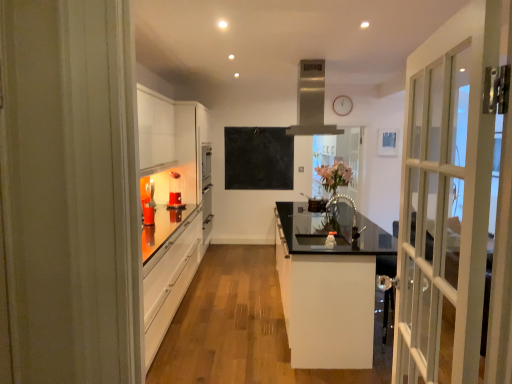
What is the approximate height of black matte chalkboard at center?

The height of black matte chalkboard at center is 1.00 meters.

In order to click on black matte chalkboard at center in this screenshot , I will do `click(258, 158)`.

What do you see at coordinates (334, 175) in the screenshot?
I see `pink floral bouquet at center` at bounding box center [334, 175].

Find the location of a particular element. The height and width of the screenshot is (384, 512). white glossy cabinet at center is located at coordinates (328, 285).

Locate an element on the screen. Image resolution: width=512 pixels, height=384 pixels. clear glass vase at center is located at coordinates (340, 155).

Locate an element on the screen. Image resolution: width=512 pixels, height=384 pixels. white wooden clock at upper center is located at coordinates (342, 105).

Considering the positions of objects clear glass vase at center and white wooden clock at upper center in the image provided, who is more to the left, clear glass vase at center or white wooden clock at upper center?

Positioned to the left is white wooden clock at upper center.

Does clear glass vase at center have a lesser height compared to white wooden clock at upper center?

No, clear glass vase at center is not shorter than white wooden clock at upper center.

From the image's perspective, between clear glass vase at center and white wooden clock at upper center, who is located below?

clear glass vase at center is shown below in the image.

How distant is clear glass vase at center from white wooden clock at upper center?

The distance of clear glass vase at center from white wooden clock at upper center is 38.72 inches.

Is pink floral bouquet at center oriented away from white wooden clock at upper center?

That's not correct — pink floral bouquet at center is not looking away from white wooden clock at upper center.

Considering the relative positions of pink floral bouquet at center and white wooden clock at upper center in the image provided, is pink floral bouquet at center to the left of white wooden clock at upper center from the viewer's perspective?

Correct, you'll find pink floral bouquet at center to the left of white wooden clock at upper center.

What are the coordinates of `flower located underneath the white wooden clock at upper center (from a real-world perspective)` in the screenshot? It's located at (334, 175).

Who is bigger, pink floral bouquet at center or white wooden clock at upper center?

pink floral bouquet at center.

Does white wooden clock at upper center turn towards matte orange glass at left?

No.

Identify the location of clock on the right of matte orange glass at left. (342, 105).

Does white wooden clock at upper center appear on the left side of matte orange glass at left?

Incorrect, white wooden clock at upper center is not on the left side of matte orange glass at left.

Is white wooden clock at upper center not within matte orange glass at left?

That's correct, white wooden clock at upper center is outside of matte orange glass at left.

Is matte orange glass at left facing towards clear glass vase at center?

No, matte orange glass at left is not oriented towards clear glass vase at center.

Can we say matte orange glass at left lies outside clear glass vase at center?

That's correct, matte orange glass at left is outside of clear glass vase at center.

In the scene shown: How different are the orientations of matte orange glass at left and clear glass vase at center in degrees?

63.7 degrees.

From a real-world perspective, which is physically above, matte orange glass at left or clear glass vase at center?

clear glass vase at center.

Relative to white glossy cabinet at center, is clear glass vase at center in front or behind?

clear glass vase at center is positioned farther from the viewer than white glossy cabinet at center.

Is clear glass vase at center wider or thinner than white glossy cabinet at center?

Clearly, clear glass vase at center has less width compared to white glossy cabinet at center.

Is clear glass vase at center positioned far away from white glossy cabinet at center?

Absolutely, clear glass vase at center is distant from white glossy cabinet at center.

Is the position of white glossy cabinet at center less distant than that of black matte chalkboard at center?

That is True.

Consider the image. Considering the positions of objects white glossy cabinet at center and black matte chalkboard at center in the image provided, who is more to the left, white glossy cabinet at center or black matte chalkboard at center?

black matte chalkboard at center.

Does white glossy cabinet at center have a larger size compared to black matte chalkboard at center?

Yes, white glossy cabinet at center is bigger than black matte chalkboard at center.

Is white glossy cabinet at center taller or shorter than black matte chalkboard at center?

Clearly, white glossy cabinet at center is shorter compared to black matte chalkboard at center.

Is point (323, 324) more distant than point (298, 109)?

No, (323, 324) is in front of (298, 109).

From the image's perspective, which is below, white glossy cabinet at center or satin silver exhaust hood at upper center?

white glossy cabinet at center is shown below in the image.

From a real-world perspective, is white glossy cabinet at center below satin silver exhaust hood at upper center?

Yes, from a real-world perspective, white glossy cabinet at center is under satin silver exhaust hood at upper center.

Is white glossy cabinet at center looking in the opposite direction of satin silver exhaust hood at upper center?

No, white glossy cabinet at center is not facing away from satin silver exhaust hood at upper center.

Where is `window directly beneath the white wooden clock at upper center (from a real-world perspective)`? Image resolution: width=512 pixels, height=384 pixels. window directly beneath the white wooden clock at upper center (from a real-world perspective) is located at coordinates (340, 155).

Where is `clock above the pink floral bouquet at center (from a real-world perspective)`? The width and height of the screenshot is (512, 384). clock above the pink floral bouquet at center (from a real-world perspective) is located at coordinates (342, 105).

Estimate the real-world distances between objects in this image. Which object is further from white wooden clock at upper center, matte orange glass at left or satin silver exhaust hood at upper center?

Among the two, matte orange glass at left is located further to white wooden clock at upper center.

Looking at the image, which one is located further to black matte chalkboard at center, clear glass vase at center or satin silver exhaust hood at upper center?

Based on the image, satin silver exhaust hood at upper center appears to be further to black matte chalkboard at center.

From the image, which object appears to be farther from white wooden clock at upper center, clear glass vase at center or pink floral bouquet at center?

clear glass vase at center is positioned further to the anchor white wooden clock at upper center.

Which object lies nearer to the anchor point white wooden clock at upper center, matte orange glass at left or white glossy cabinet at center?

matte orange glass at left.

Which object lies nearer to the anchor point satin silver exhaust hood at upper center, clear glass vase at center or white glossy cabinet at center?

Based on the image, white glossy cabinet at center appears to be nearer to satin silver exhaust hood at upper center.

From the image, which object appears to be farther from white wooden clock at upper center, white glossy cabinet at center or pink floral bouquet at center?

The object further to white wooden clock at upper center is white glossy cabinet at center.

When comparing their distances from black matte chalkboard at center, does pink floral bouquet at center or clear glass vase at center seem further?

pink floral bouquet at center lies further to black matte chalkboard at center than the other object.

Estimate the real-world distances between objects in this image. Which object is further from white glossy cabinet at center, white wooden clock at upper center or clear glass vase at center?

The object further to white glossy cabinet at center is white wooden clock at upper center.

Identify the location of clock positioned between white glossy cabinet at center and clear glass vase at center from near to far. (342, 105).

Identify the location of window between white glossy cabinet at center and black matte chalkboard at center along the z-axis. This screenshot has height=384, width=512. (340, 155).

I want to click on appliance between satin silver exhaust hood at upper center and clear glass vase at center along the z-axis, so click(x=175, y=191).

The height and width of the screenshot is (384, 512). Find the location of `exhaust hood between white glossy cabinet at center and clear glass vase at center in the front-back direction`. exhaust hood between white glossy cabinet at center and clear glass vase at center in the front-back direction is located at coordinates (311, 101).